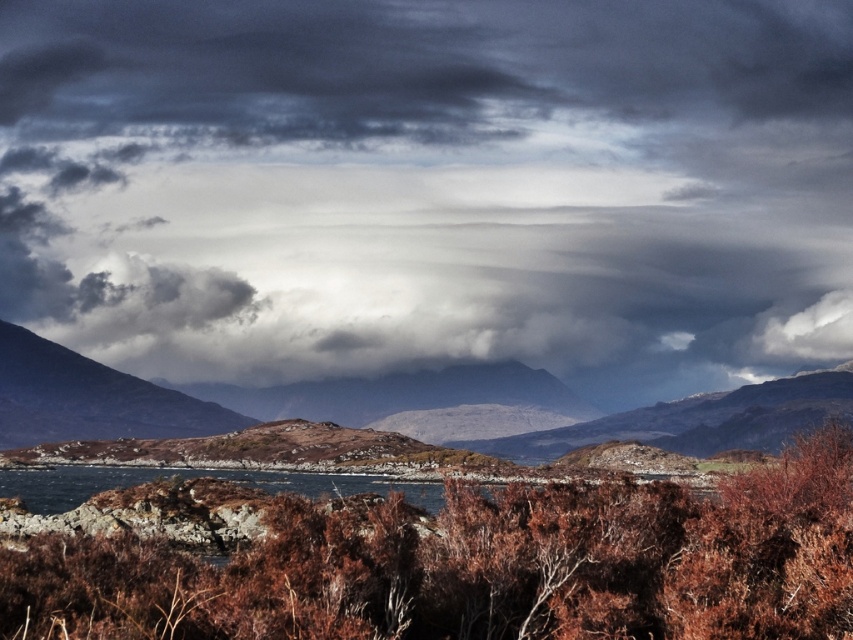
Can you confirm if brown rocky mountain at center is bigger than rugged brown mountain at left?

Correct, brown rocky mountain at center is larger in size than rugged brown mountain at left.

Which is more to the right, brown rocky mountain at center or rugged brown mountain at left?

brown rocky mountain at center

Does point (836, 396) lie behind point (73, 371)?

That is False.

Identify the location of brown rocky mountain at center. The height and width of the screenshot is (640, 853). (91, 397).

Does brown shrubbery at center have a greater height compared to rugged brown mountain at left?

No.

Which of these two, brown shrubbery at center or rugged brown mountain at left, stands taller?

Standing taller between the two is rugged brown mountain at left.

Is point (782, 550) positioned before point (90, 410)?

Yes, point (782, 550) is in front of point (90, 410).

Find the location of a particular element. Image resolution: width=853 pixels, height=640 pixels. brown shrubbery at center is located at coordinates (483, 566).

This screenshot has height=640, width=853. What do you see at coordinates (483, 566) in the screenshot?
I see `brown shrubbery at center` at bounding box center [483, 566].

Find the location of `brown shrubbery at center`. brown shrubbery at center is located at coordinates 483,566.